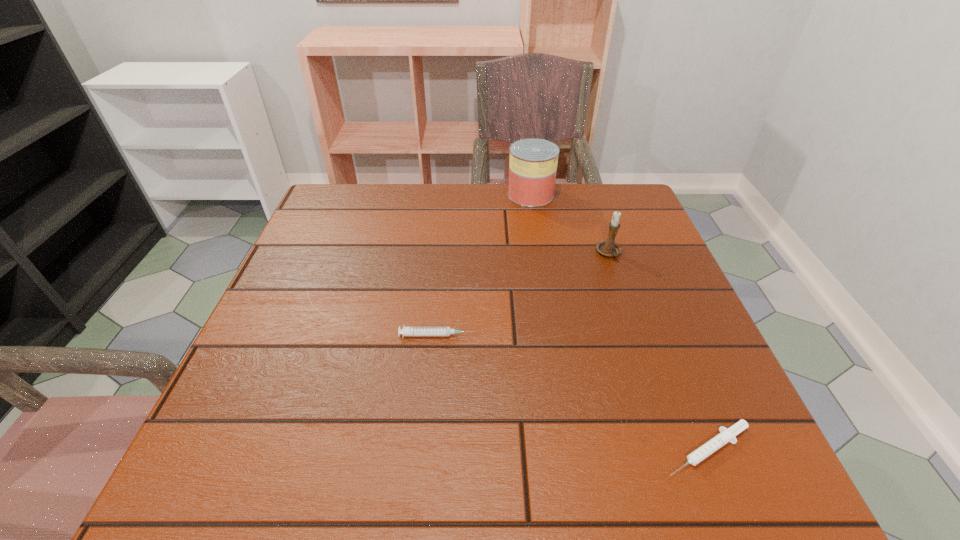
Locate an element on the screen. the farthest object is located at coordinates (533, 162).

This screenshot has width=960, height=540. Find the location of `the third object from right to left`. the third object from right to left is located at coordinates (533, 162).

This screenshot has height=540, width=960. I want to click on the third shortest object, so click(x=609, y=248).

The height and width of the screenshot is (540, 960). What are the coordinates of `candle holder` in the screenshot? It's located at (609, 248).

Where is `the left syringe`? The image size is (960, 540). the left syringe is located at coordinates (406, 331).

The image size is (960, 540). Identify the location of the leftmost object. (406, 331).

Image resolution: width=960 pixels, height=540 pixels. Find the location of `the shorter syringe`. the shorter syringe is located at coordinates (726, 435).

Locate an element on the screen. This screenshot has height=540, width=960. the nearer syringe is located at coordinates (726, 435).

At what (x,y) coordinates should I click in order to perform the action: click on vacant space located 0.220m on the right of the tallest object. Please return your answer as a coordinate pair (x, y). Looking at the image, I should click on (630, 195).

Where is `free location located on the side of the third nearest object with the handle`? free location located on the side of the third nearest object with the handle is located at coordinates (636, 331).